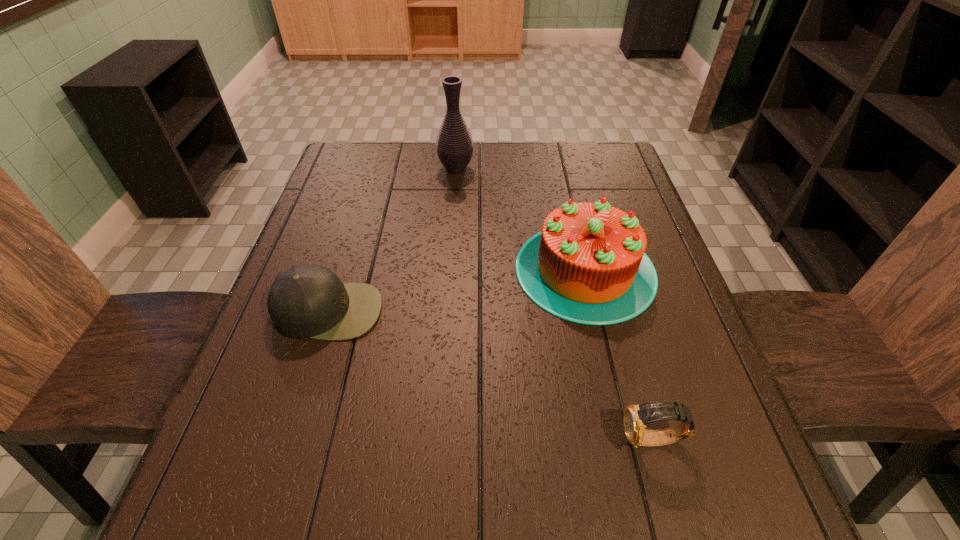
The width and height of the screenshot is (960, 540). I want to click on vacant space at the near left corner, so click(224, 498).

Where is `free space between the cake and the cap`? The image size is (960, 540). free space between the cake and the cap is located at coordinates (457, 291).

You are a GUI agent. You are given a task and a screenshot of the screen. Output one action in this format:
    pyautogui.click(x=<x>, y=<y>)
    Task: Click on the empty space between the vase and the cake
    
    Given the screenshot: What is the action you would take?
    pos(520,219)

Where is `free space between the cap and the nearest object`? free space between the cap and the nearest object is located at coordinates (491, 375).

Locate an element on the screen. Image resolution: width=960 pixels, height=540 pixels. blank region between the farthest object and the cake is located at coordinates (520, 219).

At what (x,y) coordinates should I click in order to perform the action: click on free spot between the watch and the second tallest object. Please return your answer as a coordinate pair (x, y). Looking at the image, I should click on (619, 355).

This screenshot has height=540, width=960. Find the location of `empty space between the nearest object and the third shortest object`. empty space between the nearest object and the third shortest object is located at coordinates (619, 355).

In order to click on vacant area that lies between the second tallest object and the cap in this screenshot , I will do `click(457, 291)`.

Identify which object is the closest to the second object from left to right. Please provide its 2D coordinates. Your answer should be formatted as a tuple, i.e. [(x, y)], where the tuple contains the x and y coordinates of a point satisfying the conditions above.

[(588, 265)]

At what (x,y) coordinates should I click in order to perform the action: click on object that stands as the closest to the nearest object. Please return your answer as a coordinate pair (x, y). The width and height of the screenshot is (960, 540). Looking at the image, I should click on (588, 265).